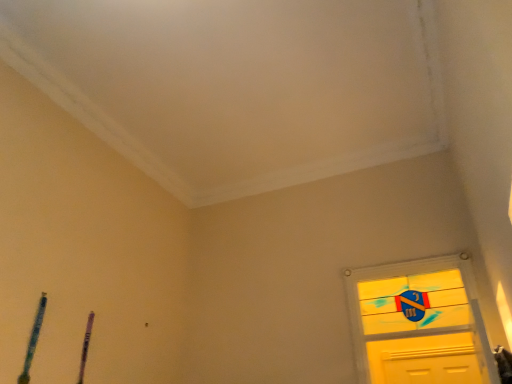
Where is `purple wood pen at lower left, which ranks as the 2th twin in front-to-back order`? purple wood pen at lower left, which ranks as the 2th twin in front-to-back order is located at coordinates (85, 347).

Describe the element at coordinates (85, 347) in the screenshot. This screenshot has width=512, height=384. I see `purple wood pen at lower left, acting as the first twin starting from the back` at that location.

In order to face blue textured pencil at lower left, the second twin positioned from the back, should I rotate leftwards or rightwards?

It's best to rotate left around 27.053 degrees.

What do you see at coordinates (33, 340) in the screenshot? I see `blue textured pencil at lower left, the second twin viewed from the right` at bounding box center [33, 340].

Where is `blue textured pencil at lower left, the second twin viewed from the right`? This screenshot has width=512, height=384. blue textured pencil at lower left, the second twin viewed from the right is located at coordinates (33, 340).

Identify the location of purple wood pen at lower left, which is the 2th twin from left to right. The width and height of the screenshot is (512, 384). (85, 347).

Between blue textured pencil at lower left, the second twin positioned from the back, and purple wood pen at lower left, acting as the first twin starting from the back, which one appears on the right side from the viewer's perspective?

purple wood pen at lower left, acting as the first twin starting from the back.

In the image, is blue textured pencil at lower left, the second twin viewed from the right, positioned in front of or behind purple wood pen at lower left, acting as the first twin starting from the back?

Clearly, blue textured pencil at lower left, the second twin viewed from the right, is in front of purple wood pen at lower left, acting as the first twin starting from the back.

Considering the points (39, 320) and (84, 367), which point is in front, point (39, 320) or point (84, 367)?

Point (39, 320)

From the image's perspective, relative to purple wood pen at lower left, which is the 2th twin from left to right, is blue textured pencil at lower left, the second twin viewed from the right, above or below?

blue textured pencil at lower left, the second twin viewed from the right, is situated higher than purple wood pen at lower left, which is the 2th twin from left to right, in the image.

From a real-world perspective, is blue textured pencil at lower left, the second twin viewed from the right, below purple wood pen at lower left, acting as the first twin starting from the back?

Indeed, from a real-world perspective, blue textured pencil at lower left, the second twin viewed from the right, is positioned beneath purple wood pen at lower left, acting as the first twin starting from the back.

Looking at their sizes, would you say blue textured pencil at lower left, the first twin from the front, is wider or thinner than purple wood pen at lower left, acting as the first twin starting from the back?

Considering their sizes, blue textured pencil at lower left, the first twin from the front, looks broader than purple wood pen at lower left, acting as the first twin starting from the back.

Between blue textured pencil at lower left, the second twin positioned from the back, and purple wood pen at lower left, which appears as the first twin when viewed from the right, which one has more height?

blue textured pencil at lower left, the second twin positioned from the back.

Looking at this image, is blue textured pencil at lower left, the second twin positioned from the back, bigger or smaller than purple wood pen at lower left, which ranks as the 2th twin in front-to-back order?

In the image, blue textured pencil at lower left, the second twin positioned from the back, appears to be larger than purple wood pen at lower left, which ranks as the 2th twin in front-to-back order.

Is blue textured pencil at lower left, the first twin in the left-to-right sequence, not inside purple wood pen at lower left, which is the 2th twin from left to right?

Yes, blue textured pencil at lower left, the first twin in the left-to-right sequence, is not within purple wood pen at lower left, which is the 2th twin from left to right.

Is the surface of blue textured pencil at lower left, the first twin in the left-to-right sequence, in direct contact with purple wood pen at lower left, which ranks as the 2th twin in front-to-back order?

No, blue textured pencil at lower left, the first twin in the left-to-right sequence, is not making contact with purple wood pen at lower left, which ranks as the 2th twin in front-to-back order.

Is blue textured pencil at lower left, the second twin viewed from the right, facing towards purple wood pen at lower left, acting as the first twin starting from the back?

No.

How many degrees apart are the facing directions of blue textured pencil at lower left, the second twin viewed from the right, and purple wood pen at lower left, which is the 2th twin from left to right?

blue textured pencil at lower left, the second twin viewed from the right, and purple wood pen at lower left, which is the 2th twin from left to right, are facing 2.16 degrees away from each other.

Could you measure the distance between blue textured pencil at lower left, the second twin viewed from the right, and purple wood pen at lower left, which appears as the first twin when viewed from the right?

blue textured pencil at lower left, the second twin viewed from the right, is 14.99 inches from purple wood pen at lower left, which appears as the first twin when viewed from the right.

Where is `twin on the left of purple wood pen at lower left, acting as the first twin starting from the back`? This screenshot has height=384, width=512. twin on the left of purple wood pen at lower left, acting as the first twin starting from the back is located at coordinates (33, 340).

Does purple wood pen at lower left, which appears as the first twin when viewed from the right, appear on the left side of blue textured pencil at lower left, the second twin positioned from the back?

In fact, purple wood pen at lower left, which appears as the first twin when viewed from the right, is to the right of blue textured pencil at lower left, the second twin positioned from the back.

Is the depth of purple wood pen at lower left, which appears as the first twin when viewed from the right, less than that of blue textured pencil at lower left, the first twin in the left-to-right sequence?

No, it is not.

Does point (89, 337) appear closer or farther from the camera than point (27, 351)?

Clearly, point (89, 337) is more distant from the camera than point (27, 351).

From the image's perspective, which is above, purple wood pen at lower left, acting as the first twin starting from the back, or blue textured pencil at lower left, the first twin from the front?

blue textured pencil at lower left, the first twin from the front, is shown above in the image.

From a real-world perspective, who is located higher, purple wood pen at lower left, acting as the first twin starting from the back, or blue textured pencil at lower left, the first twin from the front?

purple wood pen at lower left, acting as the first twin starting from the back, from a real-world perspective.

Considering the sizes of objects purple wood pen at lower left, which appears as the first twin when viewed from the right, and blue textured pencil at lower left, the first twin in the left-to-right sequence, in the image provided, who is wider, purple wood pen at lower left, which appears as the first twin when viewed from the right, or blue textured pencil at lower left, the first twin in the left-to-right sequence,?

blue textured pencil at lower left, the first twin in the left-to-right sequence, is wider.

Does purple wood pen at lower left, which ranks as the 2th twin in front-to-back order, have a lesser height compared to blue textured pencil at lower left, the first twin from the front?

Indeed, purple wood pen at lower left, which ranks as the 2th twin in front-to-back order, has a lesser height compared to blue textured pencil at lower left, the first twin from the front.

Is purple wood pen at lower left, which ranks as the 2th twin in front-to-back order, bigger than blue textured pencil at lower left, the second twin viewed from the right?

A: Actually, purple wood pen at lower left, which ranks as the 2th twin in front-to-back order, might be smaller than blue textured pencil at lower left, the second twin viewed from the right.

From the picture: Is purple wood pen at lower left, which ranks as the 2th twin in front-to-back order, situated inside blue textured pencil at lower left, the first twin in the left-to-right sequence, or outside?

purple wood pen at lower left, which ranks as the 2th twin in front-to-back order, lies outside blue textured pencil at lower left, the first twin in the left-to-right sequence.

Is purple wood pen at lower left, which appears as the first twin when viewed from the right, placed right next to blue textured pencil at lower left, the first twin from the front?

No.

Does purple wood pen at lower left, which is the 2th twin from left to right, turn towards blue textured pencil at lower left, the first twin in the left-to-right sequence?

No, purple wood pen at lower left, which is the 2th twin from left to right, is not turned towards blue textured pencil at lower left, the first twin in the left-to-right sequence.

At what (x,y) coordinates should I click in order to perform the action: click on twin lying in front of the purple wood pen at lower left, acting as the first twin starting from the back. Please return your answer as a coordinate pair (x, y). Image resolution: width=512 pixels, height=384 pixels. Looking at the image, I should click on (33, 340).

Where is `twin above the blue textured pencil at lower left, the first twin in the left-to-right sequence (from a real-world perspective)`? This screenshot has height=384, width=512. twin above the blue textured pencil at lower left, the first twin in the left-to-right sequence (from a real-world perspective) is located at coordinates (85, 347).

Locate an element on the screen. The width and height of the screenshot is (512, 384). twin located underneath the purple wood pen at lower left, which is the 2th twin from left to right (from a real-world perspective) is located at coordinates click(x=33, y=340).